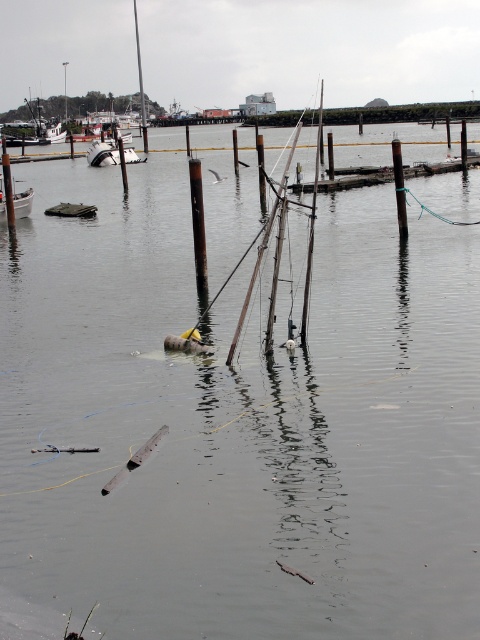
Which is behind, point (275, 282) or point (126, 154)?

The point (126, 154) is more distant.

Does rusty metal barrel at center appear on the left side of white matte boat at upper left?

In fact, rusty metal barrel at center is to the right of white matte boat at upper left.

What are the coordinates of `rusty metal barrel at center` in the screenshot? It's located at (259, 259).

Is point (0, 212) positioned in front of point (98, 150)?

That is True.

Find the location of a particular element. Image resolution: width=480 pixels, height=640 pixels. white plastic boat at left is located at coordinates (12, 196).

Is point (9, 193) positioned in front of point (90, 164)?

Yes, point (9, 193) is in front of point (90, 164).

Where is `white plastic boat at left`? The width and height of the screenshot is (480, 640). white plastic boat at left is located at coordinates (12, 196).

Can you confirm if rusty metal barrel at center is positioned to the left of white plastic boat at left?

No, rusty metal barrel at center is not to the left of white plastic boat at left.

Is rusty metal barrel at center smaller than white plastic boat at left?

Actually, rusty metal barrel at center might be larger than white plastic boat at left.

Who is more distant from viewer, (252, 282) or (6, 200)?

Positioned behind is point (6, 200).

The height and width of the screenshot is (640, 480). In order to click on rusty metal barrel at center in this screenshot , I will do `click(259, 259)`.